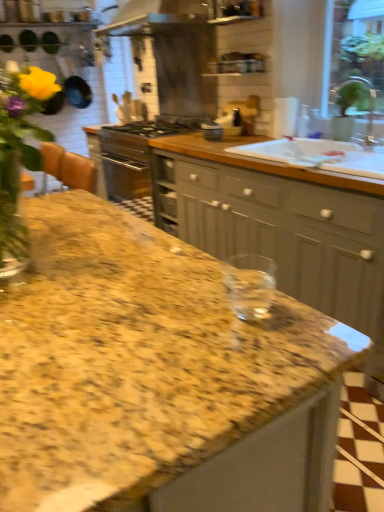
Question: From the image's perspective, is satin silver exhaust hood at upper center positioned above or below white ceramic sink at upper right?

Choices:
 (A) below
 (B) above

Answer: (B)

Question: Considering the positions of satin silver exhaust hood at upper center and white ceramic sink at upper right in the image, is satin silver exhaust hood at upper center bigger or smaller than white ceramic sink at upper right?

Choices:
 (A) big
 (B) small

Answer: (A)

Question: Considering the real-world distances, which object is farthest from the matte gray cabinets at center?

Choices:
 (A) transparent glass jar at center
 (B) matte black kettle at center, arranged as the 1th appliance when viewed from the front
 (C) white ceramic sink at upper right
 (D) satin silver exhaust hood at upper center
 (E) silver metallic faucet at upper right

Answer: (D)

Question: Which of these objects is positioned closest to the silver metallic faucet at upper right?

Choices:
 (A) matte gray cabinets at center
 (B) matte black toaster at center, the 2th appliance viewed from the front
 (C) satin silver exhaust hood at upper center
 (D) transparent glass jar at center
 (E) white ceramic sink at upper right

Answer: (E)